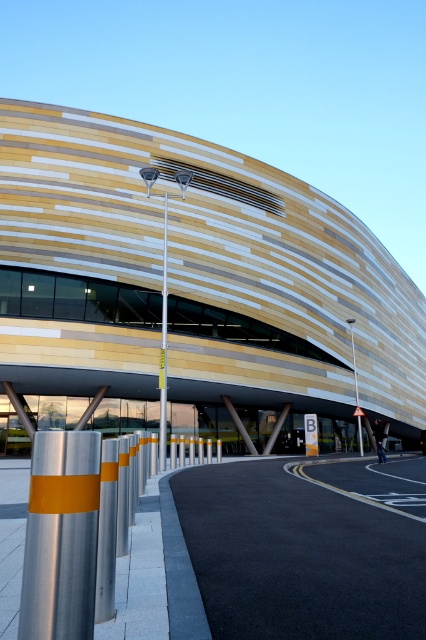
Question: Does wooden paneling at center appear on the right side of black asphalt road at lower center?

Choices:
 (A) yes
 (B) no

Answer: (A)

Question: Considering the real-world distances, which object is closest to the metallic pole at center?

Choices:
 (A) wooden paneling at center
 (B) silver metallic bollard at lower left
 (C) black asphalt road at lower center

Answer: (A)

Question: Based on their relative distances, which object is farther from the black asphalt road at lower center?

Choices:
 (A) metallic pole at center
 (B) metallic silver pole at center

Answer: (A)

Question: Where is wooden paneling at center located in relation to metallic silver pole at center in the image?

Choices:
 (A) left
 (B) right

Answer: (B)

Question: Considering the real-world distances, which object is farthest from the black asphalt road at lower center?

Choices:
 (A) silver metallic bollard at lower left
 (B) metallic silver pole at center
 (C) metallic pole at center

Answer: (C)

Question: Is silver metallic bollard at lower left to the right of metallic silver pole at center from the viewer's perspective?

Choices:
 (A) yes
 (B) no

Answer: (A)